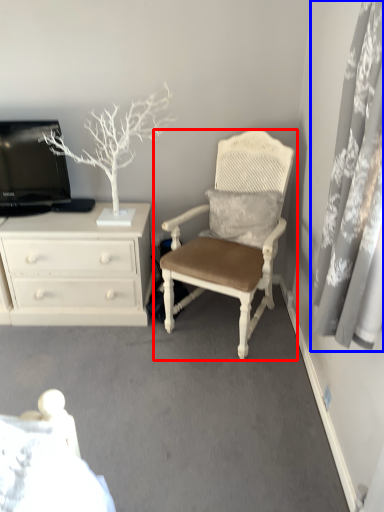
Question: Which point is further to the camera, chair (highlighted by a red box) or curtain (highlighted by a blue box)?

Choices:
 (A) chair
 (B) curtain

Answer: (A)